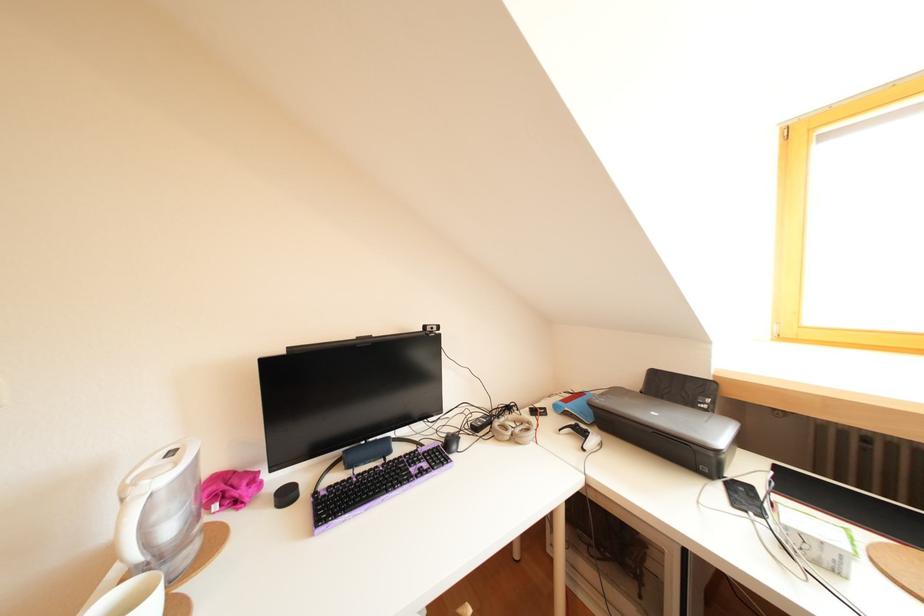
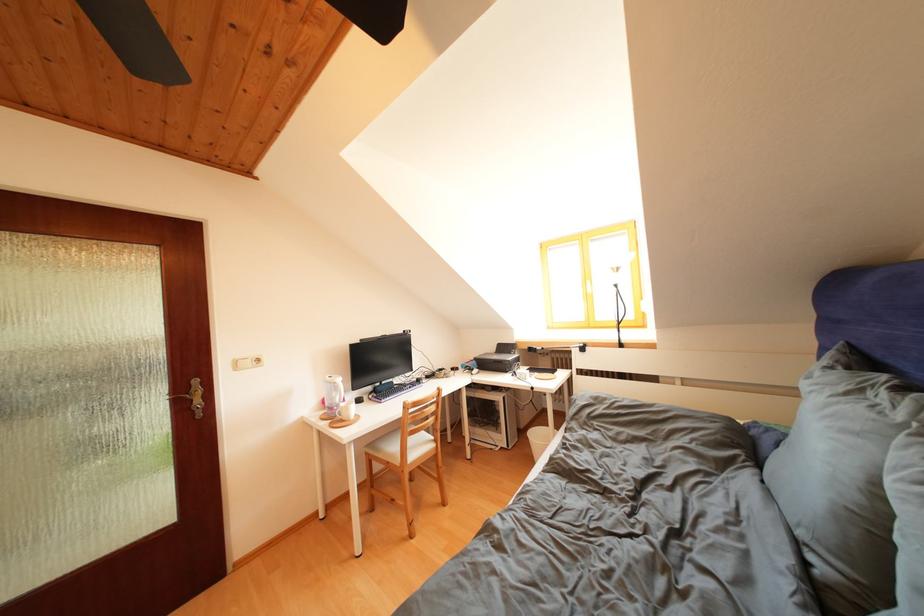
The point at [699,407] is marked in the first image. Where is the corresponding point in the second image?

(517, 358)